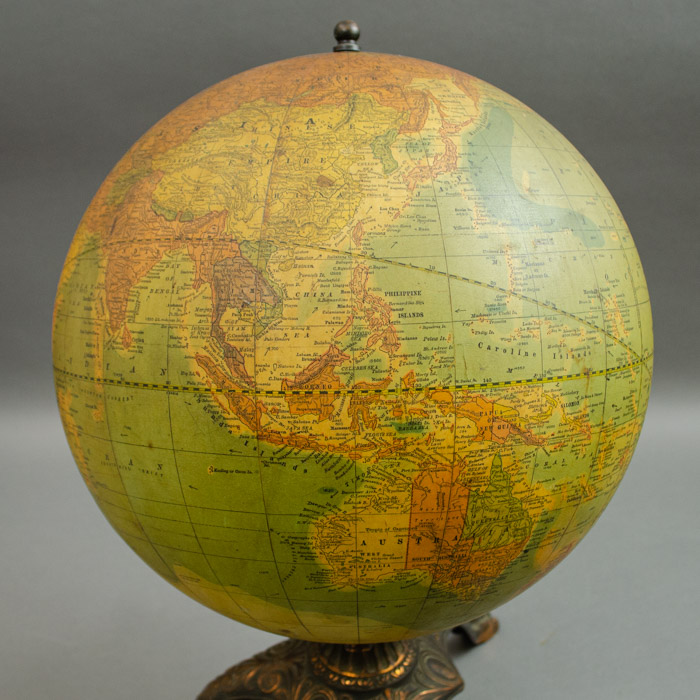
This screenshot has width=700, height=700. I want to click on metal stand, so click(x=402, y=675).